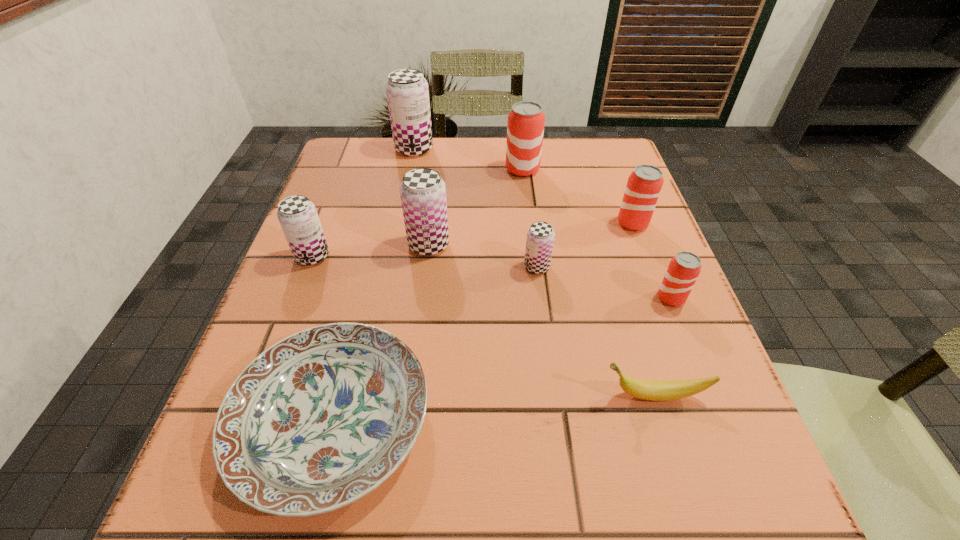
Where is `the smallest orange beer can`? This screenshot has width=960, height=540. the smallest orange beer can is located at coordinates (684, 268).

Locate an element on the screen. yellow banana is located at coordinates (654, 390).

Image resolution: width=960 pixels, height=540 pixels. Find the location of `the second shortest object`. the second shortest object is located at coordinates (654, 390).

In order to click on the shortest object in this screenshot , I will do `click(318, 420)`.

You are a GUI agent. You are given a task and a screenshot of the screen. Output one action in this format:
    pyautogui.click(x=<x>, y=<y>)
    Task: Click on the vacant space located on the left of the tallest beer can
    
    Given the screenshot: What is the action you would take?
    pyautogui.click(x=340, y=149)

Locate an element on the screen. vacant region located on the front of the biggest orange beer can is located at coordinates (527, 208).

This screenshot has width=960, height=540. I want to click on free spot located 0.400m on the right of the third smallest purple beer can, so click(638, 245).

Locate an element on the screen. free space located 0.130m on the back of the second nearest orange beer can is located at coordinates (617, 181).

The image size is (960, 540). Identify the location of vacant region located 0.330m on the right of the second smallest purple beer can. (490, 256).

Image resolution: width=960 pixels, height=540 pixels. Find the location of `vacant space located on the front of the smallest purple beer can`. vacant space located on the front of the smallest purple beer can is located at coordinates (543, 315).